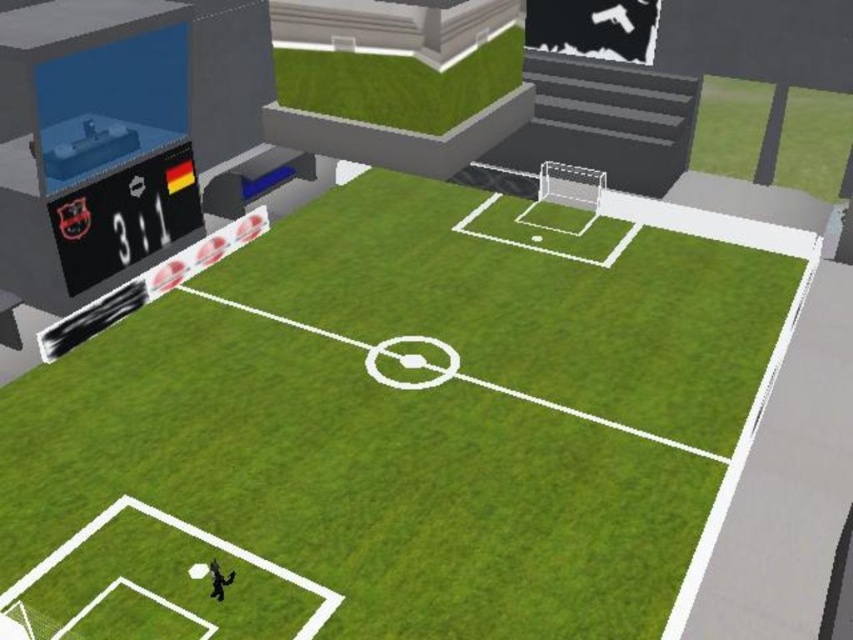
The image size is (853, 640). Describe the element at coordinates (415, 419) in the screenshot. I see `green grass football field at center` at that location.

Does green grass football field at center appear under shiny black scoreboard at upper left?

Correct, green grass football field at center is located below shiny black scoreboard at upper left.

Between point (250, 348) and point (68, 198), which one is positioned in front?

Point (68, 198)

This screenshot has width=853, height=640. Find the location of `green grass football field at center`. green grass football field at center is located at coordinates tap(415, 419).